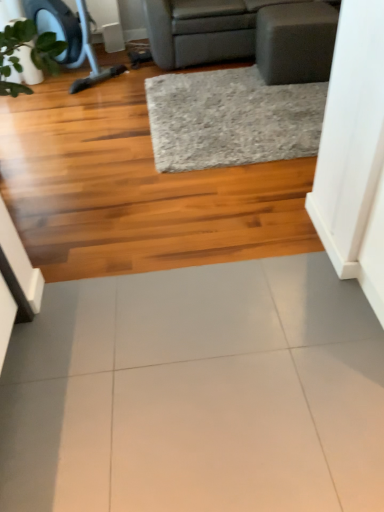
Question: Is gray fabric studio couch at upper center situated inside white glossy tile at center or outside?

Choices:
 (A) inside
 (B) outside

Answer: (B)

Question: Considering the positions of point (148, 15) and point (304, 304), is point (148, 15) closer or farther from the camera than point (304, 304)?

Choices:
 (A) closer
 (B) farther

Answer: (B)

Question: Estimate the real-world distances between objects in this image. Which object is farther from the gray textured rug at center?

Choices:
 (A) white glossy tile at center
 (B) gray fabric studio couch at upper center

Answer: (A)

Question: Which of these objects is positioned farthest from the gray fabric studio couch at upper center?

Choices:
 (A) gray textured rug at center
 (B) white glossy tile at center

Answer: (B)